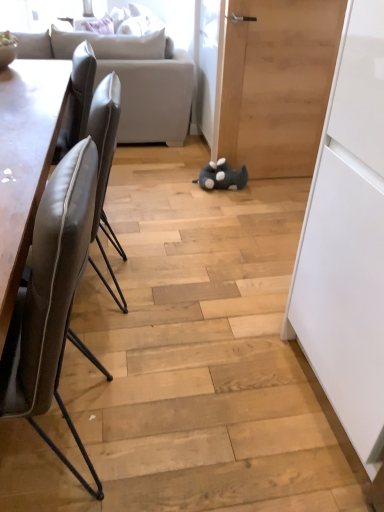
Question: Is the surface of leather at left, which is the 2th chair in front-to-back order, in direct contact with gray plush toy at center?

Choices:
 (A) yes
 (B) no

Answer: (B)

Question: Is leather at left, which appears as the first chair when viewed from the back, thinner than gray plush toy at center?

Choices:
 (A) yes
 (B) no

Answer: (B)

Question: From the image's perspective, does leather at left, which is the 2th chair in front-to-back order, appear lower than gray plush toy at center?

Choices:
 (A) yes
 (B) no

Answer: (A)

Question: Considering the relative sizes of leather at left, which is the 2th chair in front-to-back order, and gray plush toy at center in the image provided, is leather at left, which is the 2th chair in front-to-back order, smaller than gray plush toy at center?

Choices:
 (A) no
 (B) yes

Answer: (A)

Question: Could you tell me if leather at left, which appears as the first chair when viewed from the back, is turned towards gray plush toy at center?

Choices:
 (A) yes
 (B) no

Answer: (B)

Question: Is wooden door at center bigger or smaller than gray plush toy at center?

Choices:
 (A) big
 (B) small

Answer: (A)

Question: Based on their positions, is wooden door at center located to the left or right of gray plush toy at center?

Choices:
 (A) left
 (B) right

Answer: (B)

Question: Is wooden door at center situated inside gray plush toy at center or outside?

Choices:
 (A) outside
 (B) inside

Answer: (A)

Question: Does point (286, 56) appear closer or farther from the camera than point (243, 184)?

Choices:
 (A) closer
 (B) farther

Answer: (A)

Question: Is wooden door at center inside the boundaries of leather at left, which appears as the first chair when viewed from the back, or outside?

Choices:
 (A) inside
 (B) outside

Answer: (B)

Question: From the image's perspective, is wooden door at center above or below leather at left, which is the 2th chair in front-to-back order?

Choices:
 (A) below
 (B) above

Answer: (B)

Question: In the image, is wooden door at center on the left side or the right side of leather at left, which appears as the first chair when viewed from the back?

Choices:
 (A) left
 (B) right

Answer: (B)

Question: Considering the positions of wooden door at center and leather at left, which is the 2th chair in front-to-back order, in the image, is wooden door at center wider or thinner than leather at left, which is the 2th chair in front-to-back order,?

Choices:
 (A) wide
 (B) thin

Answer: (A)

Question: In terms of size, does leather at left, which is the 2th chair in front-to-back order, appear bigger or smaller than wooden door at center?

Choices:
 (A) small
 (B) big

Answer: (A)

Question: Is leather at left, which is the 2th chair in front-to-back order, wider or thinner than wooden door at center?

Choices:
 (A) thin
 (B) wide

Answer: (A)